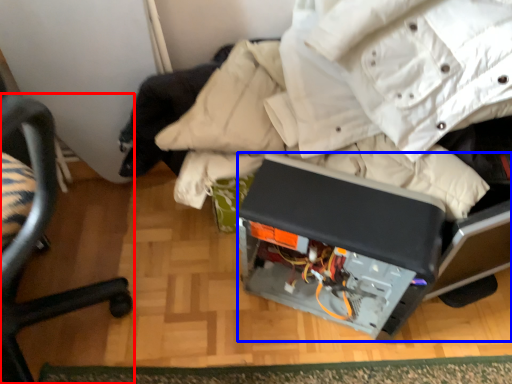
Question: Which object appears farthest to the camera in this image, chair (highlighted by a red box) or wide (highlighted by a blue box)?

Choices:
 (A) chair
 (B) wide

Answer: (B)